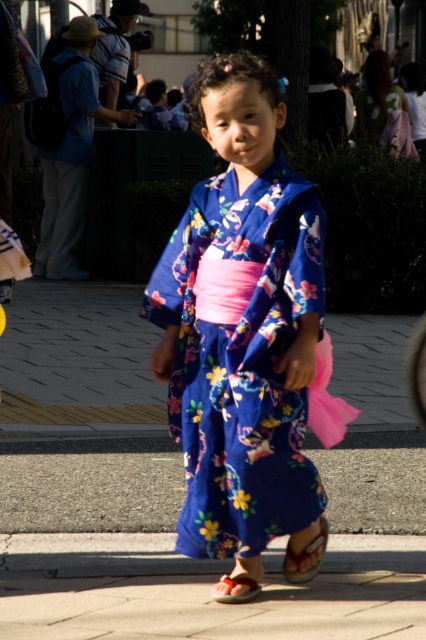
Consider the image. Who is taller, floral silk kimono at center or matte orange sandal at lower center?

With more height is floral silk kimono at center.

Does floral silk kimono at center have a greater height compared to matte orange sandal at lower center?

Yes, floral silk kimono at center is taller than matte orange sandal at lower center.

Who is more forward, [301,180] or [256,580]?

Point [301,180] is in front.

Image resolution: width=426 pixels, height=640 pixels. I want to click on floral silk kimono at center, so click(x=241, y=326).

Can you confirm if floral silk kimono at center is smaller than leather sandal at lower center?

No, floral silk kimono at center is not smaller than leather sandal at lower center.

Is floral silk kimono at center bigger than leather sandal at lower center?

Yes.

Image resolution: width=426 pixels, height=640 pixels. Describe the element at coordinates (241, 326) in the screenshot. I see `floral silk kimono at center` at that location.

In order to click on floral silk kimono at center in this screenshot , I will do `click(241, 326)`.

Between leather sandal at lower center and matte orange sandal at lower center, which one has more height?

leather sandal at lower center is taller.

Does point (287, 566) lie behind point (230, 602)?

Yes, it is behind point (230, 602).

Identify the location of leather sandal at lower center. (305, 556).